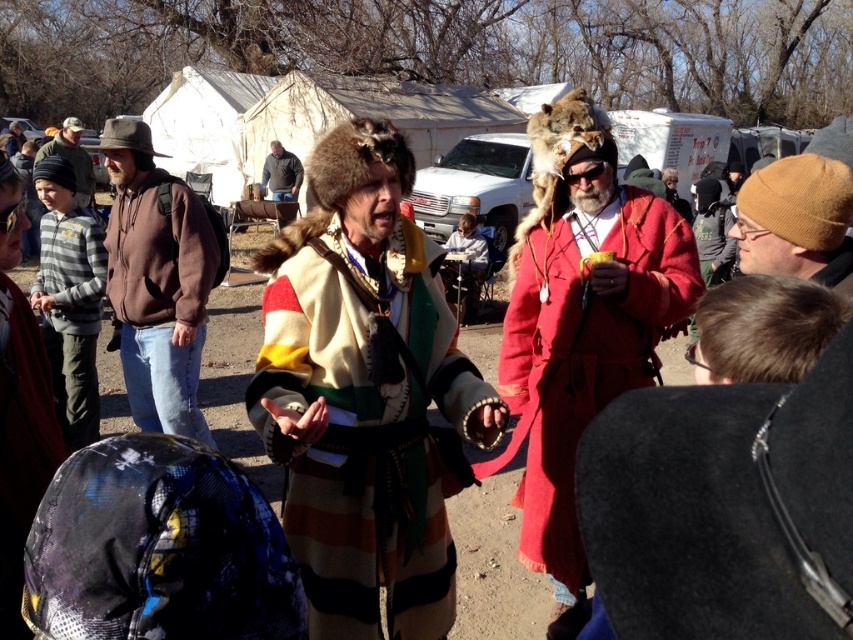
Between red woolen coat at center and fur hat at center, which one is positioned higher?

fur hat at center is above.

Locate an element on the screen. The image size is (853, 640). red woolen coat at center is located at coordinates (583, 349).

Describe the element at coordinates (583, 349) in the screenshot. I see `red woolen coat at center` at that location.

At what (x,y) coordinates should I click in order to perform the action: click on red woolen coat at center. Please return your answer as a coordinate pair (x, y). Image resolution: width=853 pixels, height=640 pixels. Looking at the image, I should click on (583, 349).

You are a GUI agent. You are given a task and a screenshot of the screen. Output one action in this format:
    pyautogui.click(x=<x>, y=<y>)
    Task: Click on the brown fleece jacket at left
    
    Given the screenshot: What is the action you would take?
    pyautogui.click(x=157, y=282)

Where is `brown fleece jacket at left`? The height and width of the screenshot is (640, 853). brown fleece jacket at left is located at coordinates (157, 282).

Where is `brown fleece jacket at left`? The width and height of the screenshot is (853, 640). brown fleece jacket at left is located at coordinates (157, 282).

Is gray striped sweater at left bigger than knitted wool beanie at left?

Actually, gray striped sweater at left might be smaller than knitted wool beanie at left.

Who is more forward, (49, 248) or (51, 150)?

Point (49, 248)

This screenshot has width=853, height=640. What are the coordinates of `gray striped sweater at left` in the screenshot? It's located at (71, 316).